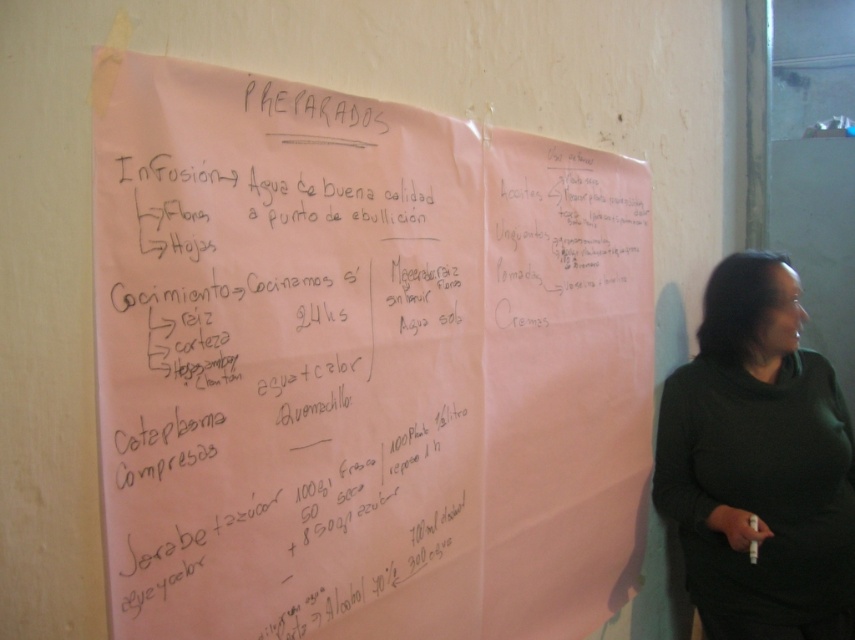
Question: Which of the following is the farthest from the observer?

Choices:
 (A) pink paper at upper center
 (B) black sweater at right

Answer: (B)

Question: Can you confirm if pink paper at upper center is bigger than black sweater at right?

Choices:
 (A) yes
 (B) no

Answer: (A)

Question: Which point is closer to the camera?

Choices:
 (A) (585, 260)
 (B) (838, 627)

Answer: (A)

Question: Is pink paper at upper center thinner than black sweater at right?

Choices:
 (A) yes
 (B) no

Answer: (B)

Question: Can you confirm if pink paper at upper center is thinner than black sweater at right?

Choices:
 (A) no
 (B) yes

Answer: (A)